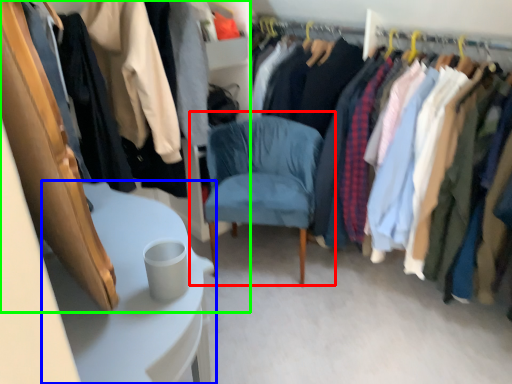
Question: Which object is the closest to the chair (highlighted by a red box)? Choose among these: table (highlighted by a blue box) or closet (highlighted by a green box).

Choices:
 (A) table
 (B) closet

Answer: (A)